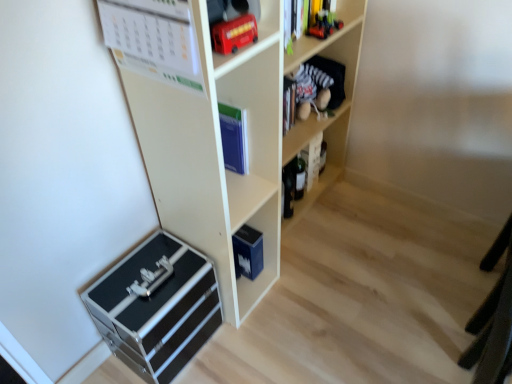
Identify the location of free space in front of matte black toolbox at lower left, placed as the second shelf when sorted from bottom to top. This screenshot has width=512, height=384. (257, 352).